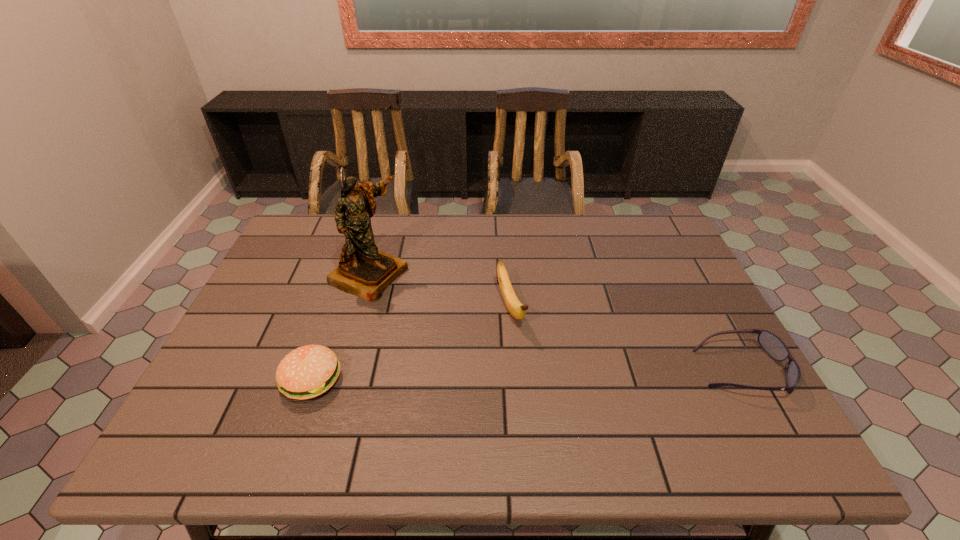
The image size is (960, 540). In order to click on free space between the banana and the sunglasses in this screenshot , I will do `click(626, 339)`.

Identify the location of free space between the third object from left to right and the tallest object. (440, 291).

Where is `vacant region between the sunglasses and the patty`? vacant region between the sunglasses and the patty is located at coordinates (526, 375).

Image resolution: width=960 pixels, height=540 pixels. What are the coordinates of `object that is the closest to the patty` in the screenshot? It's located at (364, 271).

Identify which object is the second nearest to the patty. Please provide its 2D coordinates. Your answer should be formatted as a tuple, i.e. [(x, y)], where the tuple contains the x and y coordinates of a point satisfying the conditions above.

[(515, 307)]

Image resolution: width=960 pixels, height=540 pixels. In order to click on free space that satisfies the following two spatial constraints: 1. on the front side of the rightmost object; 2. on the lenses of the figurine in this screenshot , I will do `click(341, 370)`.

Where is `vacant space that satisfies the following two spatial constraints: 1. on the front side of the rightmost object; 2. on the lenses of the tallest object`? Image resolution: width=960 pixels, height=540 pixels. vacant space that satisfies the following two spatial constraints: 1. on the front side of the rightmost object; 2. on the lenses of the tallest object is located at coordinates (341, 370).

Find the location of a particular element. The image size is (960, 540). vacant space that satisfies the following two spatial constraints: 1. on the back side of the rightmost object; 2. on the lenses of the patty is located at coordinates (315, 370).

Where is `vacant space that satisfies the following two spatial constraints: 1. on the back side of the figurine; 2. on the left side of the patty`? This screenshot has width=960, height=540. vacant space that satisfies the following two spatial constraints: 1. on the back side of the figurine; 2. on the left side of the patty is located at coordinates (348, 274).

This screenshot has height=540, width=960. I want to click on blank area in the image that satisfies the following two spatial constraints: 1. on the back side of the patty; 2. on the right side of the figurine, so click(x=348, y=274).